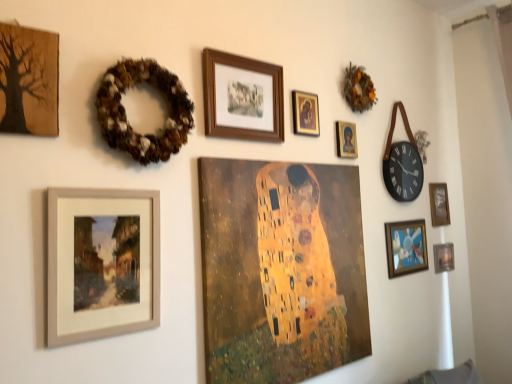
Question: Considering the relative positions of matte wooden frame at lower left, placed as the 2th picture frame when sorted from left to right, and brown textured wreath at upper left, the 2th decor positioned from the back, in the image provided, is matte wooden frame at lower left, placed as the 2th picture frame when sorted from left to right, behind brown textured wreath at upper left, the 2th decor positioned from the back,?

Choices:
 (A) yes
 (B) no

Answer: (B)

Question: Can you confirm if matte wooden frame at lower left, placed as the 2th picture frame when sorted from left to right, is bigger than brown textured wreath at upper left, the first decor viewed from the front?

Choices:
 (A) no
 (B) yes

Answer: (A)

Question: Is matte wooden frame at lower left, placed as the 2th picture frame when sorted from left to right, taller than brown textured wreath at upper left, the first decor viewed from the front?

Choices:
 (A) no
 (B) yes

Answer: (B)

Question: Is brown textured wreath at upper left, placed as the first decor when sorted from bottom to top, located within matte wooden frame at lower left, which appears as the 8th picture frame when viewed from the right?

Choices:
 (A) yes
 (B) no

Answer: (B)

Question: Is matte wooden frame at lower left, which appears as the 8th picture frame when viewed from the right, oriented towards brown textured wreath at upper left, which is the first decor in left-to-right order?

Choices:
 (A) yes
 (B) no

Answer: (B)

Question: In terms of width, does gold textured canvas at center, the fourth picture frame positioned from the left, look wider or thinner when compared to wooden framed picture at lower right, the 7th picture frame in the left-to-right sequence?

Choices:
 (A) thin
 (B) wide

Answer: (B)

Question: Considering the positions of gold textured canvas at center, the fourth picture frame positioned from the left, and wooden framed picture at lower right, the 3th picture frame when ordered from right to left, in the image, is gold textured canvas at center, the fourth picture frame positioned from the left, bigger or smaller than wooden framed picture at lower right, the 3th picture frame when ordered from right to left,?

Choices:
 (A) small
 (B) big

Answer: (B)

Question: Would you say gold textured canvas at center, the 6th picture frame in the right-to-left sequence, is to the left or to the right of wooden framed picture at lower right, the 7th picture frame in the left-to-right sequence, in the picture?

Choices:
 (A) left
 (B) right

Answer: (A)

Question: From a real-world perspective, relative to wooden framed picture at lower right, the 3th picture frame when ordered from right to left, is gold textured canvas at center, the 6th picture frame in the right-to-left sequence, vertically above or below?

Choices:
 (A) below
 (B) above

Answer: (A)

Question: Considering the positions of gold-framed portrait at upper center, which is the fifth picture frame in left-to-right order, and brown textured wreath at upper left, arranged as the second decor when viewed from the right, in the image, is gold-framed portrait at upper center, which is the fifth picture frame in left-to-right order, taller or shorter than brown textured wreath at upper left, arranged as the second decor when viewed from the right,?

Choices:
 (A) tall
 (B) short

Answer: (B)

Question: Considering the positions of point (306, 127) and point (142, 150), is point (306, 127) closer or farther from the camera than point (142, 150)?

Choices:
 (A) farther
 (B) closer

Answer: (A)

Question: Do you think gold-framed portrait at upper center, placed as the 5th picture frame when sorted from right to left, is within brown textured wreath at upper left, the 2th decor positioned from the back, or outside of it?

Choices:
 (A) outside
 (B) inside

Answer: (A)

Question: Considering the positions of gold-framed portrait at upper center, which is the fifth picture frame in left-to-right order, and brown textured wreath at upper left, the 2th decor positioned from the back, in the image, is gold-framed portrait at upper center, which is the fifth picture frame in left-to-right order, bigger or smaller than brown textured wreath at upper left, the 2th decor positioned from the back,?

Choices:
 (A) small
 (B) big

Answer: (A)

Question: From the image's perspective, is wooden textured tree at upper left, marked as the 1th picture frame in a left-to-right arrangement, above or below matte wooden frame at lower left, placed as the 2th picture frame when sorted from left to right?

Choices:
 (A) below
 (B) above

Answer: (B)

Question: Considering the positions of wooden textured tree at upper left, acting as the 9th picture frame starting from the right, and matte wooden frame at lower left, which appears as the 8th picture frame when viewed from the right, in the image, is wooden textured tree at upper left, acting as the 9th picture frame starting from the right, bigger or smaller than matte wooden frame at lower left, which appears as the 8th picture frame when viewed from the right,?

Choices:
 (A) big
 (B) small

Answer: (B)